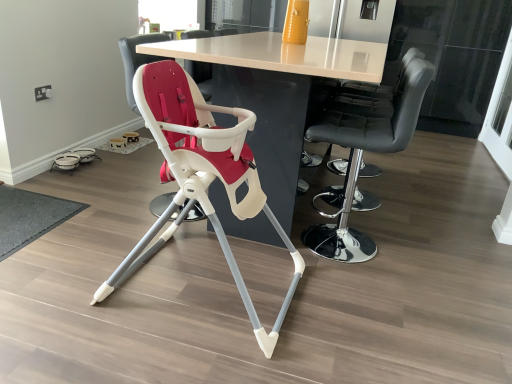
You are a GUI agent. You are given a task and a screenshot of the screen. Output one action in this format:
    pyautogui.click(x=<x>, y=<y>)
    Task: Click on the free point to the right of black leather bar stool at right, marked as the third chair in a left-to-right arrangement
    This screenshot has height=384, width=512.
    Given the screenshot: What is the action you would take?
    pyautogui.click(x=421, y=250)